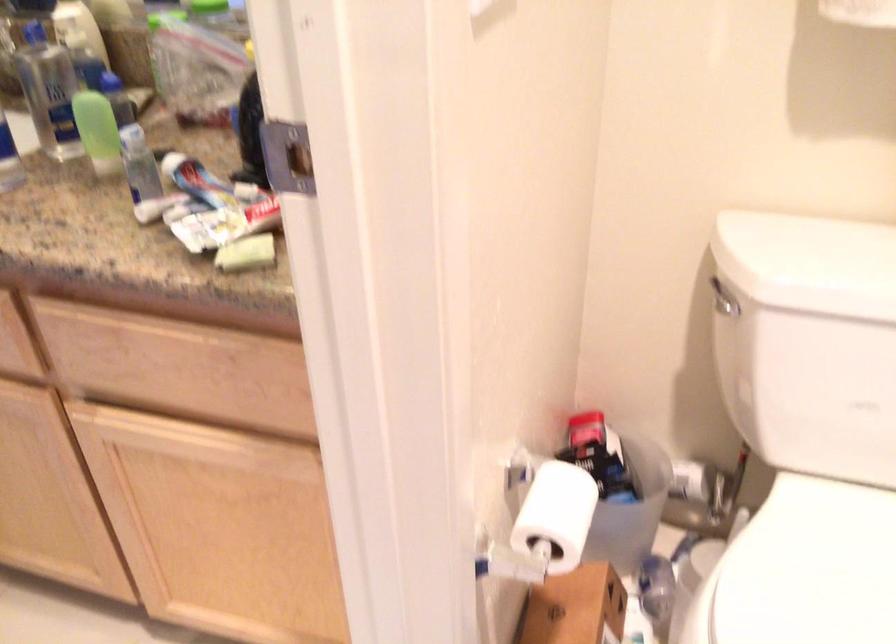
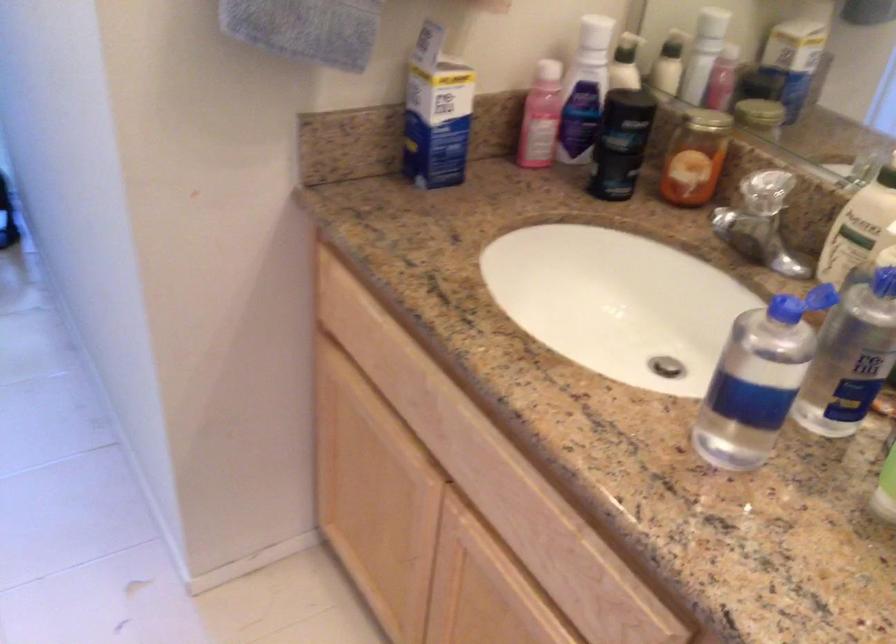
Question: The camera is either moving clockwise (left) or counter-clockwise (right) around the object. The first image is from the beginning of the video and the second image is from the end. Is the camera moving left or right when shooting the video?

Choices:
 (A) Left
 (B) Right

Answer: (B)